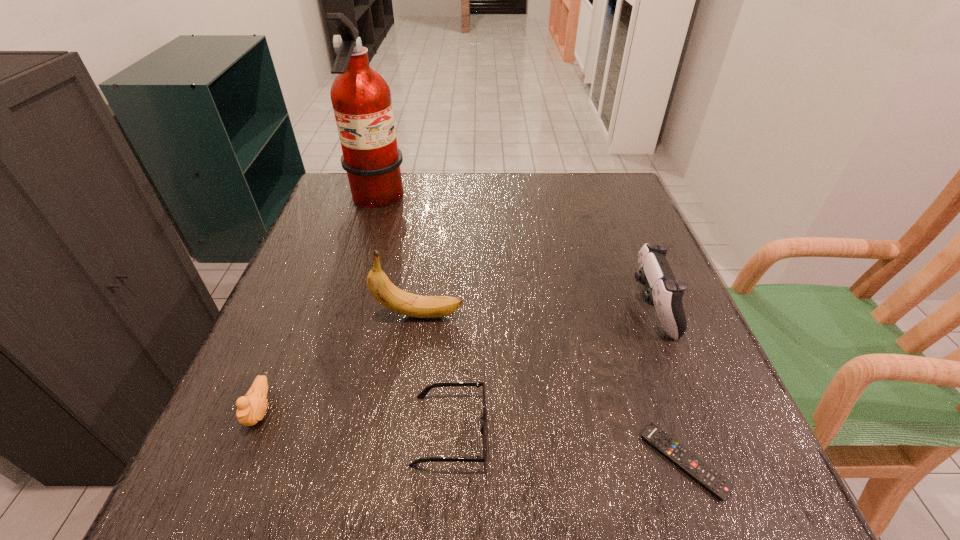
At what (x,y) coordinates should I click in order to perform the action: click on remote control located in the right edge section of the desktop. Please return your answer as a coordinate pair (x, y). Image resolution: width=960 pixels, height=540 pixels. Looking at the image, I should click on tap(713, 481).

Image resolution: width=960 pixels, height=540 pixels. In order to click on object present at the far left corner in this screenshot , I will do `click(361, 99)`.

Find the location of a particular element. Image resolution: width=960 pixels, height=540 pixels. object present at the near right corner is located at coordinates (713, 481).

You are a GUI agent. You are given a task and a screenshot of the screen. Output one action in this format:
    pyautogui.click(x=<x>, y=<y>)
    Task: Click on the free location at the far edge of the desktop
    The width and height of the screenshot is (960, 540).
    Given the screenshot: What is the action you would take?
    pyautogui.click(x=420, y=174)

Find the location of a particular element. free location at the near edge of the desktop is located at coordinates (591, 487).

Locate an element on the screen. The image size is (960, 540). blank space at the left edge of the desktop is located at coordinates (321, 320).

At what (x,y) coordinates should I click in order to perform the action: click on free space at the right edge of the desktop. Please return your answer as a coordinate pair (x, y). This screenshot has width=960, height=540. Looking at the image, I should click on (689, 376).

You are a GUI agent. You are given a task and a screenshot of the screen. Output one action in this format:
    pyautogui.click(x=<x>, y=<y>)
    Task: Click on the blank space at the far left corner of the desktop
    
    Given the screenshot: What is the action you would take?
    pyautogui.click(x=320, y=210)

The image size is (960, 540). Find the location of `vacant point located between the shortest object and the control`. vacant point located between the shortest object and the control is located at coordinates (668, 384).

The width and height of the screenshot is (960, 540). Find the location of `empty space between the fifth shortest object and the control`. empty space between the fifth shortest object and the control is located at coordinates (536, 311).